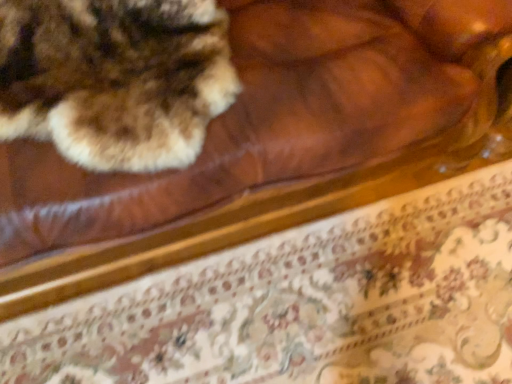
I want to click on calico fur cat at upper left, so click(115, 78).

Describe the element at coordinates (115, 78) in the screenshot. I see `calico fur cat at upper left` at that location.

Locate an element on the screen. calico fur cat at upper left is located at coordinates (115, 78).